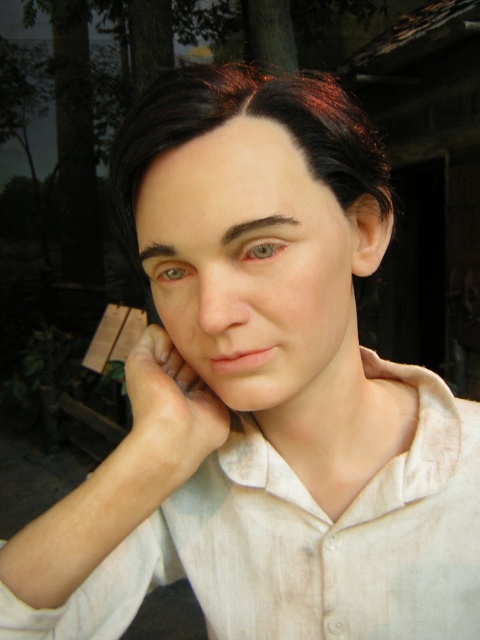
Question: Observing the image, what is the correct spatial positioning of smooth skin hand at center in reference to pink matte skin at center?

Choices:
 (A) left
 (B) right

Answer: (A)

Question: Does dark brown shiny hair at center appear on the left side of smooth skin hand at center?

Choices:
 (A) yes
 (B) no

Answer: (B)

Question: Which point is farther to the camera?

Choices:
 (A) pink matte skin at center
 (B) smooth skin forehead at center
 (C) smooth skin hand at center

Answer: (C)

Question: In this image, where is smooth skin forehead at center located relative to smooth skin hand at center?

Choices:
 (A) above
 (B) below

Answer: (A)

Question: Among these objects, which one is farthest from the camera?

Choices:
 (A) pink matte skin at center
 (B) smooth skin face at center

Answer: (A)

Question: Considering the real-world distances, which object is closest to the smooth skin ear at upper right?

Choices:
 (A) pink matte skin at center
 (B) smooth skin forehead at center
 (C) smooth skin face at center
 (D) dark brown shiny hair at center

Answer: (C)